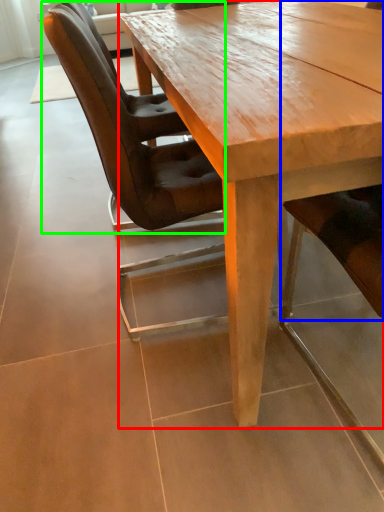
Question: Based on their relative distances, which object is farther from coffee table (highlighted by a red box)? Choose from chair (highlighted by a blue box) and chair (highlighted by a green box).

Choices:
 (A) chair
 (B) chair

Answer: (A)